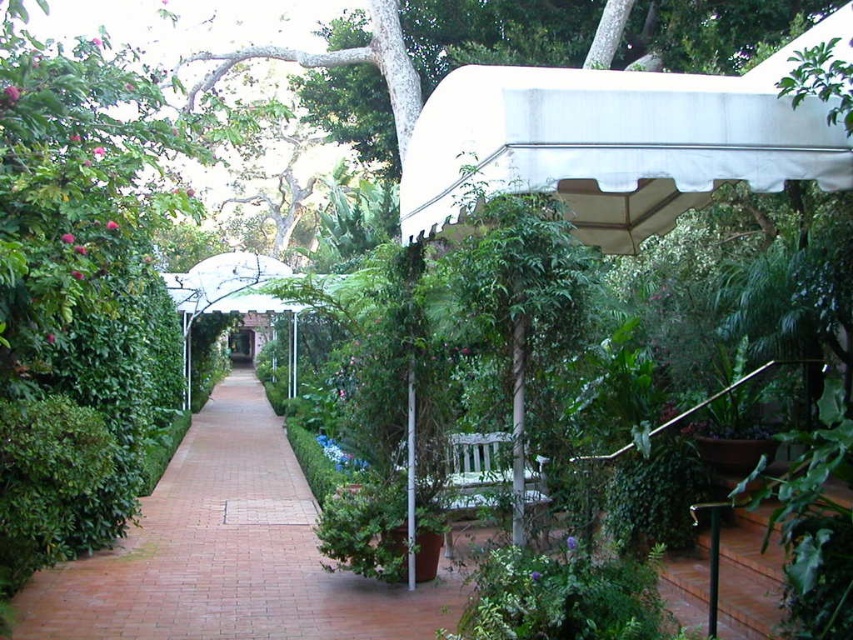
Question: Is white fabric canopy at upper right further to the viewer compared to brick at center?

Choices:
 (A) yes
 (B) no

Answer: (B)

Question: Is white fabric canopy at upper right closer to the viewer compared to brick at center?

Choices:
 (A) yes
 (B) no

Answer: (A)

Question: Can you confirm if white fabric canopy at upper right is positioned below brick at center?

Choices:
 (A) yes
 (B) no

Answer: (B)

Question: Which point is closer to the camera?

Choices:
 (A) white fabric canopy at upper right
 (B) brick at center

Answer: (A)

Question: Which point is closer to the camera?

Choices:
 (A) white fabric canopy at upper right
 (B) brick at center

Answer: (A)